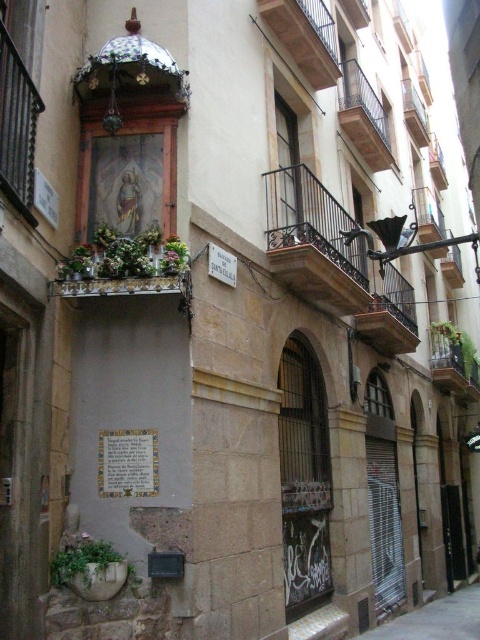
Question: Estimate the real-world distances between objects in this image. Which object is closer to the brown wooden balcony at upper center?

Choices:
 (A) rustic wood balcony at upper center
 (B) gray concrete pavement at lower center
 (C) rustic wrought iron balcony at center

Answer: (A)

Question: Considering the relative positions of brown wooden balcony at upper center and white paper plaque at center in the image provided, where is brown wooden balcony at upper center located with respect to white paper plaque at center?

Choices:
 (A) left
 (B) right

Answer: (B)

Question: Which object appears farthest from the camera in this image?

Choices:
 (A) gray concrete pavement at lower center
 (B) rustic wood balcony at upper center

Answer: (B)

Question: Which point appears closest to the camera in this image?

Choices:
 (A) (430, 602)
 (B) (127, 476)
 (C) (328, 266)
 (D) (371, 120)

Answer: (B)

Question: Is rustic wrought iron balcony at center to the left of gray concrete pavement at lower center from the viewer's perspective?

Choices:
 (A) no
 (B) yes

Answer: (B)

Question: Is gray concrete pavement at lower center smaller than rustic wood balcony at upper center?

Choices:
 (A) yes
 (B) no

Answer: (B)